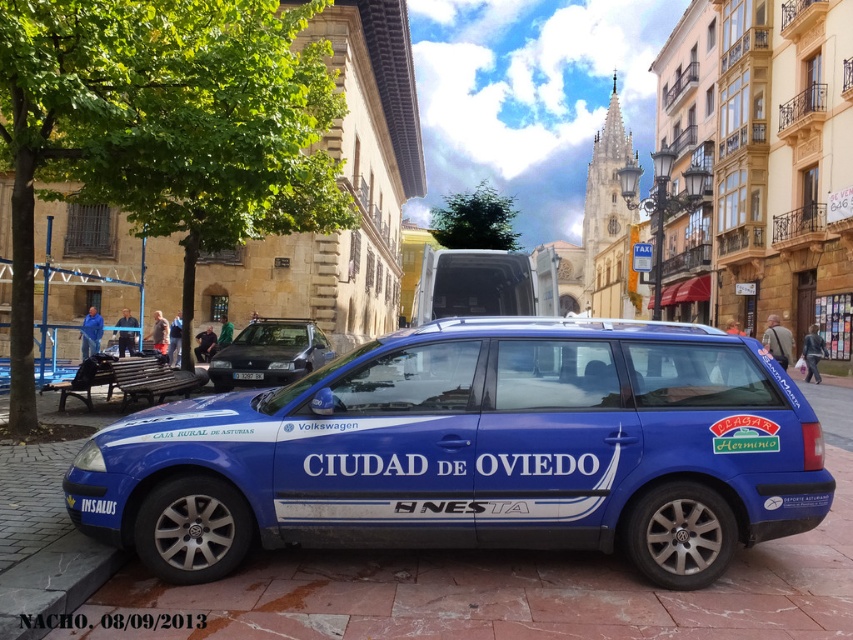
You are a delivery person who needs to park your vehicle in the parking spot marked by the blue metallic car at center. However, there is a black plastic license plate at center blocking the entrance. Can you drive your vehicle through the space between them?

The blue metallic car at center is positioned under the black plastic license plate at center, meaning the license plate is above the car. Since the license plate is part of the car itself, there is no space between them for the vehicle to pass through.

You are standing on the cobblestone street in front of the blue metallic car at center. A tour guide tells you that the car is exactly 4.43 meters away from you. If you want to take a photo of the car without any people in the frame, how far back should you move?

You should move back to a distance greater than 4.43 meters from the blue metallic car at center to ensure there are no people blocking the view.